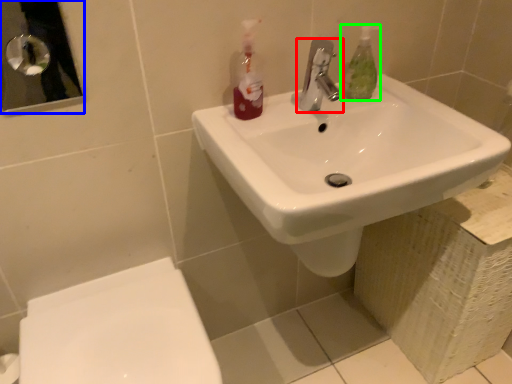
Question: Which is farther away from tap (highlighted by a red box)? mirror (highlighted by a blue box) or mouthwash (highlighted by a green box)?

Choices:
 (A) mirror
 (B) mouthwash

Answer: (A)